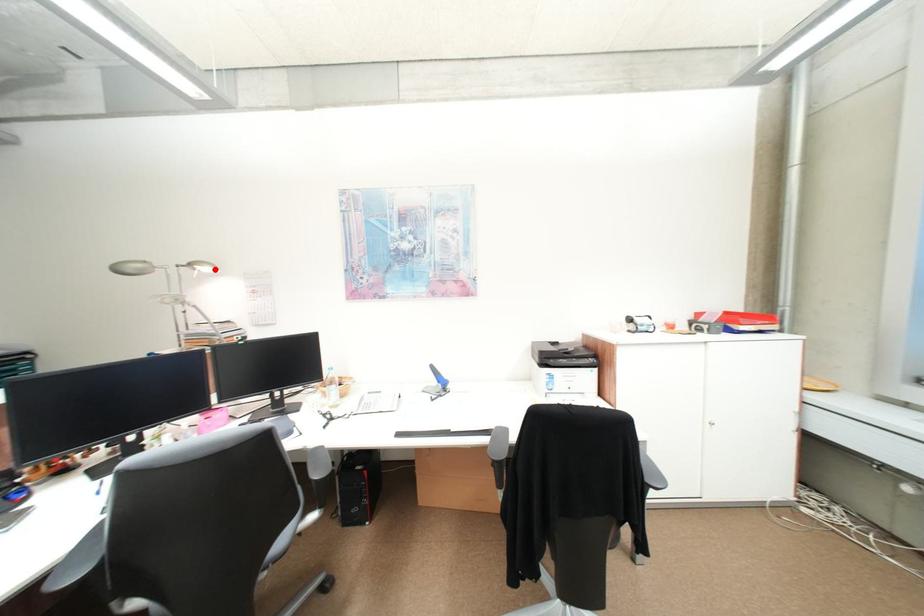
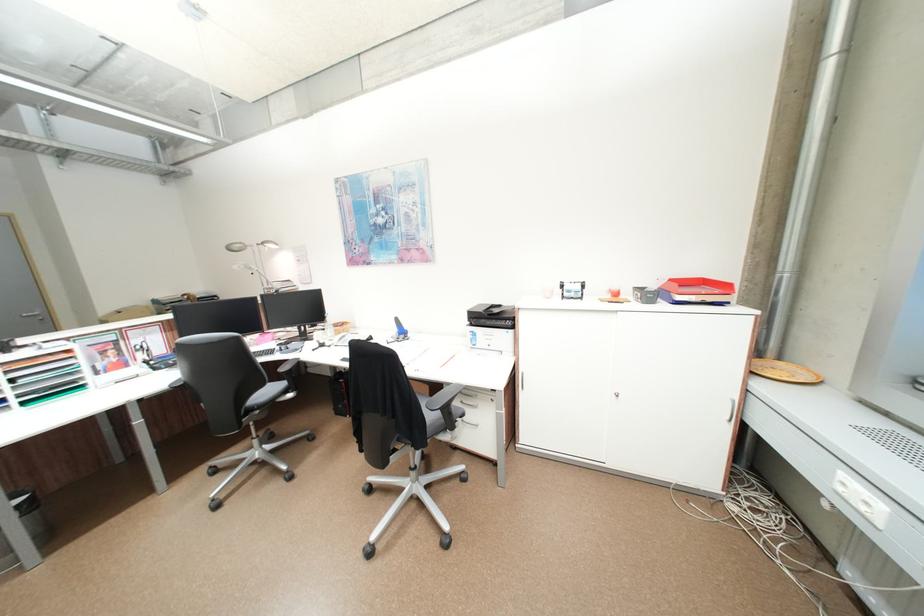
Locate, in the second image, the point that corresponds to the highlighted location in the first image.

(281, 246)